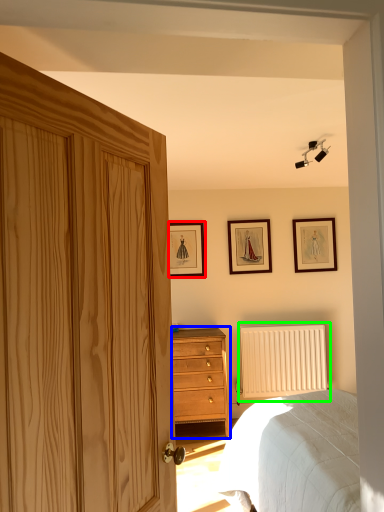
Question: Which object is the closest to the picture frame (highlighted by a red box)? Choose among these: chest of drawers (highlighted by a blue box) or radiator (highlighted by a green box).

Choices:
 (A) chest of drawers
 (B) radiator

Answer: (A)